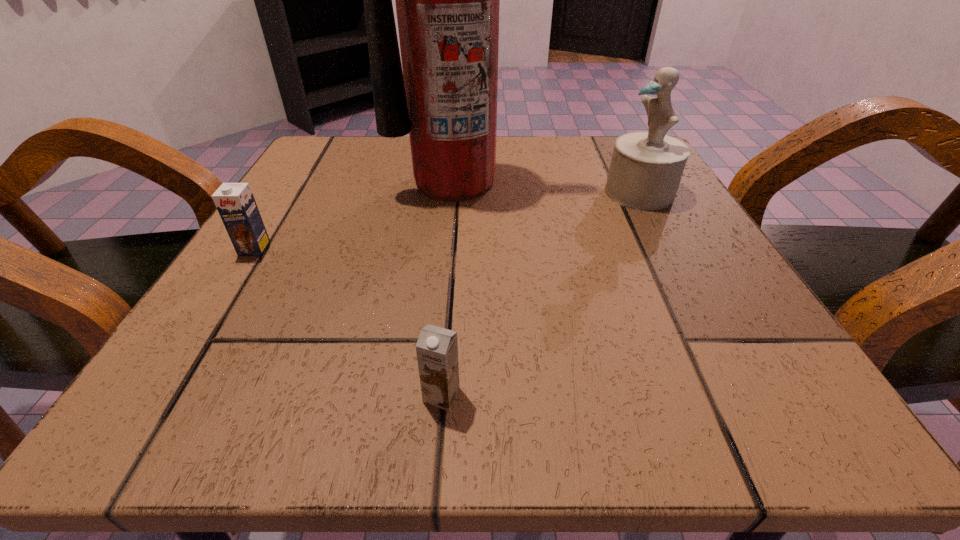
Where is `fire extinguisher`? This screenshot has height=540, width=960. fire extinguisher is located at coordinates (447, 0).

The height and width of the screenshot is (540, 960). In order to click on the rightmost object in this screenshot , I will do coord(646,168).

Where is `the third shortest object`? The image size is (960, 540). the third shortest object is located at coordinates (646, 168).

You are a GUI agent. You are given a task and a screenshot of the screen. Output one action in this format:
    pyautogui.click(x=<x>, y=<y>)
    Task: Click on the third farthest object
    The height and width of the screenshot is (540, 960).
    Given the screenshot: What is the action you would take?
    pyautogui.click(x=235, y=202)

Find the location of a particular element. This screenshot has height=540, width=960. the leftmost object is located at coordinates (235, 202).

Locate an element on the screen. The width and height of the screenshot is (960, 540). the nearer chocolate milk is located at coordinates (437, 348).

Identify the location of the nearest object. This screenshot has width=960, height=540. (437, 348).

Identify the location of vacant space situated 0.380m on the front of the fire extinguisher near the operation label. (436, 380).

The height and width of the screenshot is (540, 960). Find the location of `vacant space positioned at the beak of the third shortest object`. vacant space positioned at the beak of the third shortest object is located at coordinates (437, 192).

Where is `free location located at the beak of the third shortest object`? The width and height of the screenshot is (960, 540). free location located at the beak of the third shortest object is located at coordinates (398, 192).